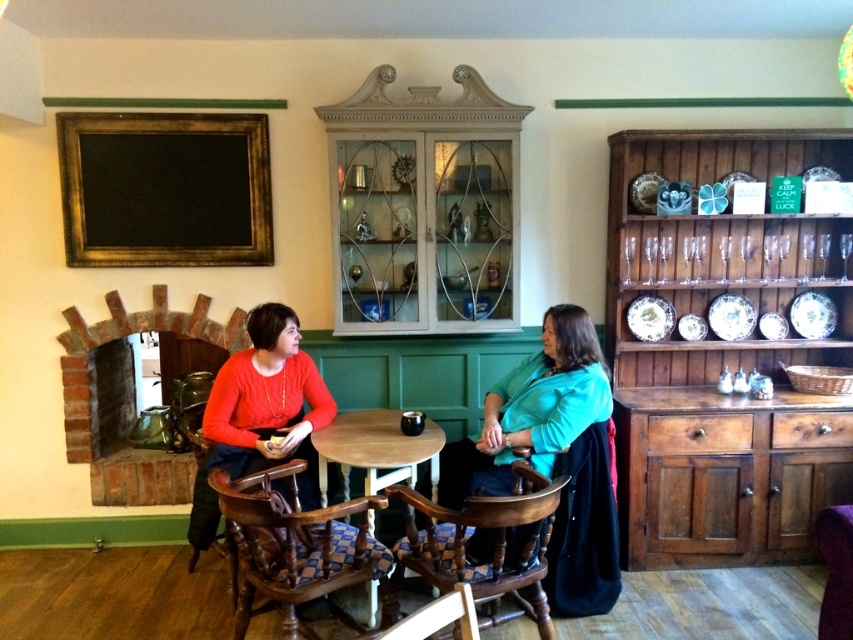
Question: Which point is closer to the camera?

Choices:
 (A) wooden chair at lower center
 (B) wooden chair with checkered upholstery at center
 (C) light brown wooden table at center
 (D) matte red sweater at center

Answer: (A)

Question: Which of these objects is positioned farthest from the gold-toned wooden frame at upper left?

Choices:
 (A) teal fabric shawl at center
 (B) velvet purple chair at lower right

Answer: (B)

Question: Considering the relative positions of gold-toned wooden frame at upper left and wooden chair at lower center in the image provided, where is gold-toned wooden frame at upper left located with respect to wooden chair at lower center?

Choices:
 (A) above
 (B) below

Answer: (A)

Question: Is wooden polished chair at center to the left of wooden chair at lower center from the viewer's perspective?

Choices:
 (A) no
 (B) yes

Answer: (B)

Question: Can you confirm if matte red sweater at center is positioned above light brown wooden table at center?

Choices:
 (A) no
 (B) yes

Answer: (B)

Question: Among these objects, which one is nearest to the camera?

Choices:
 (A) light brown wooden table at center
 (B) teal fabric shawl at center
 (C) wooden chair with checkered upholstery at center

Answer: (C)